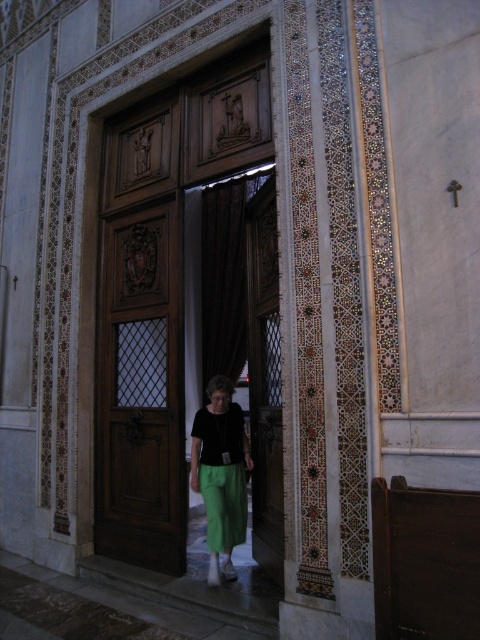
Does polished wood door at center have a greater width compared to green fabric skirt at center?

Yes, polished wood door at center is wider than green fabric skirt at center.

Can you confirm if polished wood door at center is positioned below green fabric skirt at center?

No, polished wood door at center is not below green fabric skirt at center.

Locate an element on the screen. polished wood door at center is located at coordinates (141, 388).

Who is positioned more to the right, polished wood door at center or wooden at center?

Positioned to the right is wooden at center.

Does polished wood door at center have a greater width compared to wooden at center?

Correct, the width of polished wood door at center exceeds that of wooden at center.

Locate an element on the screen. The height and width of the screenshot is (640, 480). polished wood door at center is located at coordinates (141, 388).

In order to click on polished wood door at center in this screenshot , I will do (141, 388).

Measure the distance between wooden at center and green fabric skirt at center.

17.35 inches

Between wooden at center and green fabric skirt at center, which one appears on the left side from the viewer's perspective?

From the viewer's perspective, green fabric skirt at center appears more on the left side.

This screenshot has width=480, height=640. I want to click on wooden at center, so click(264, 380).